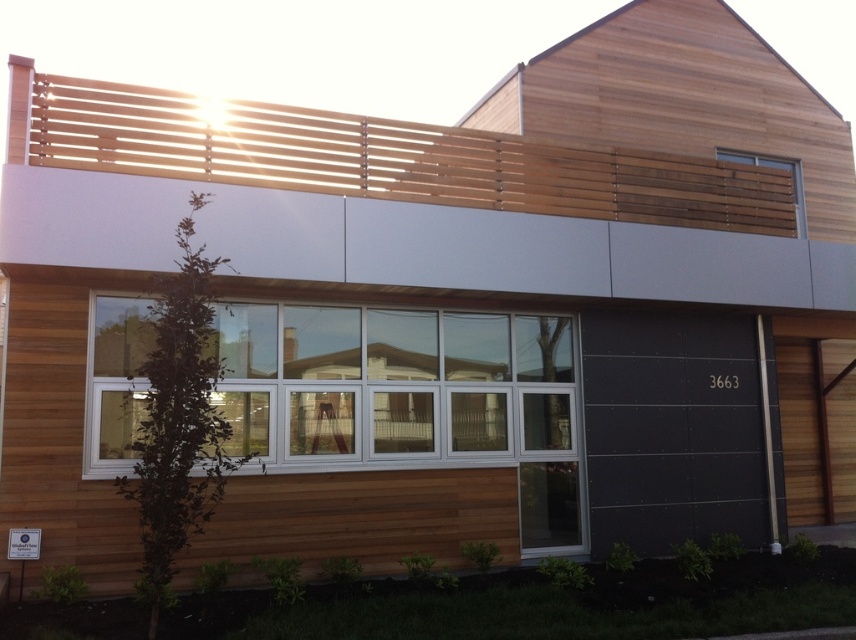
Which of these two, clear glass window at center or wooden slats at upper right, stands taller?

With more height is clear glass window at center.

At what (x,y) coordinates should I click in order to perform the action: click on clear glass window at center. Please return your answer as a coordinate pair (x, y). The width and height of the screenshot is (856, 640). Looking at the image, I should click on (409, 397).

At what (x,y) coordinates should I click in order to perform the action: click on clear glass window at center. Please return your answer as a coordinate pair (x, y). The width and height of the screenshot is (856, 640). Looking at the image, I should click on (409, 397).